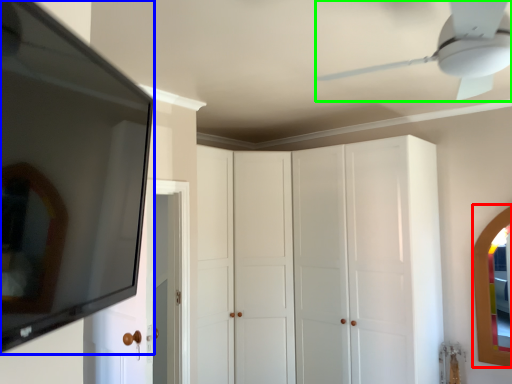
Question: Which object is positioned farthest from mirror (highlighted by a red box)? Select from mirror (highlighted by a blue box) and ceiling fan (highlighted by a green box).

Choices:
 (A) mirror
 (B) ceiling fan

Answer: (A)